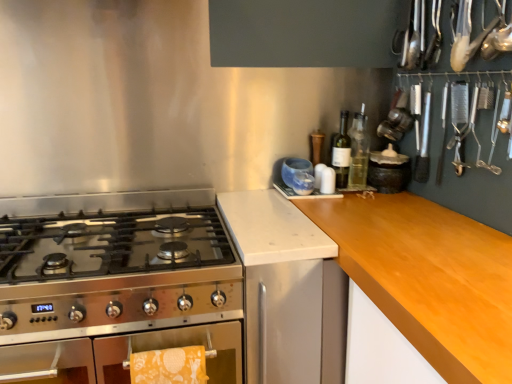
Question: Can you confirm if matte black jar at upper right is smaller than clear glass bottle at upper right, the 2th bottle in the left-to-right sequence?

Choices:
 (A) yes
 (B) no

Answer: (B)

Question: Is matte black jar at upper right not close to clear glass bottle at upper right, the 2th bottle in the left-to-right sequence?

Choices:
 (A) yes
 (B) no

Answer: (B)

Question: Does matte black jar at upper right have a greater width compared to clear glass bottle at upper right, the 2th bottle in the left-to-right sequence?

Choices:
 (A) yes
 (B) no

Answer: (A)

Question: Is matte black jar at upper right in front of clear glass bottle at upper right, the 2th bottle in the left-to-right sequence?

Choices:
 (A) yes
 (B) no

Answer: (A)

Question: Is matte black jar at upper right to the left of clear glass bottle at upper right, the 2th bottle in the left-to-right sequence, from the viewer's perspective?

Choices:
 (A) no
 (B) yes

Answer: (A)

Question: Which is correct: matte black jar at upper right is inside stainless steel gas stove at left, or outside of it?

Choices:
 (A) outside
 (B) inside

Answer: (A)

Question: Considering the positions of matte black jar at upper right and stainless steel gas stove at left in the image, is matte black jar at upper right bigger or smaller than stainless steel gas stove at left?

Choices:
 (A) big
 (B) small

Answer: (B)

Question: Considering the positions of matte black jar at upper right and stainless steel gas stove at left in the image, is matte black jar at upper right wider or thinner than stainless steel gas stove at left?

Choices:
 (A) wide
 (B) thin

Answer: (B)

Question: Considering the positions of point (408, 162) and point (102, 226), is point (408, 162) closer or farther from the camera than point (102, 226)?

Choices:
 (A) farther
 (B) closer

Answer: (A)

Question: Considering the positions of stainless steel gas stove at left and yellow printed towel at lower left in the image, is stainless steel gas stove at left wider or thinner than yellow printed towel at lower left?

Choices:
 (A) wide
 (B) thin

Answer: (A)

Question: Is stainless steel gas stove at left bigger or smaller than yellow printed towel at lower left?

Choices:
 (A) big
 (B) small

Answer: (A)

Question: From their relative heights in the image, would you say stainless steel gas stove at left is taller or shorter than yellow printed towel at lower left?

Choices:
 (A) tall
 (B) short

Answer: (B)

Question: From the image's perspective, relative to yellow printed towel at lower left, is stainless steel gas stove at left above or below?

Choices:
 (A) above
 (B) below

Answer: (A)

Question: Considering the positions of point (367, 152) and point (348, 157), is point (367, 152) closer or farther from the camera than point (348, 157)?

Choices:
 (A) farther
 (B) closer

Answer: (A)

Question: Would you say clear glass bottle at upper right, the 2th bottle in the left-to-right sequence, is to the left or to the right of green glass bottle at upper right, which appears as the 1th bottle when viewed from the left, in the picture?

Choices:
 (A) right
 (B) left

Answer: (A)